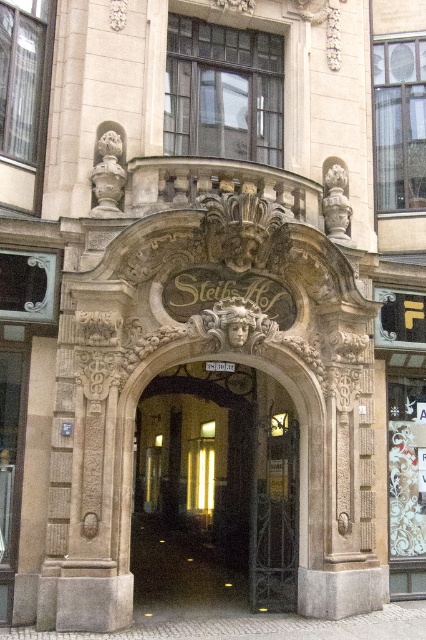
Question: Is dark brown stone archway at center positioned before matte glass door at center?

Choices:
 (A) no
 (B) yes

Answer: (B)

Question: Which point appears farthest from the camera in this image?

Choices:
 (A) (164, 524)
 (B) (158, 429)

Answer: (B)

Question: Is dark brown stone archway at center above matte glass door at center?

Choices:
 (A) yes
 (B) no

Answer: (B)

Question: Does dark brown stone archway at center appear on the right side of matte glass door at center?

Choices:
 (A) yes
 (B) no

Answer: (B)

Question: Which point is farther from the camera taking this photo?

Choices:
 (A) (x=250, y=387)
 (B) (x=138, y=440)

Answer: (B)